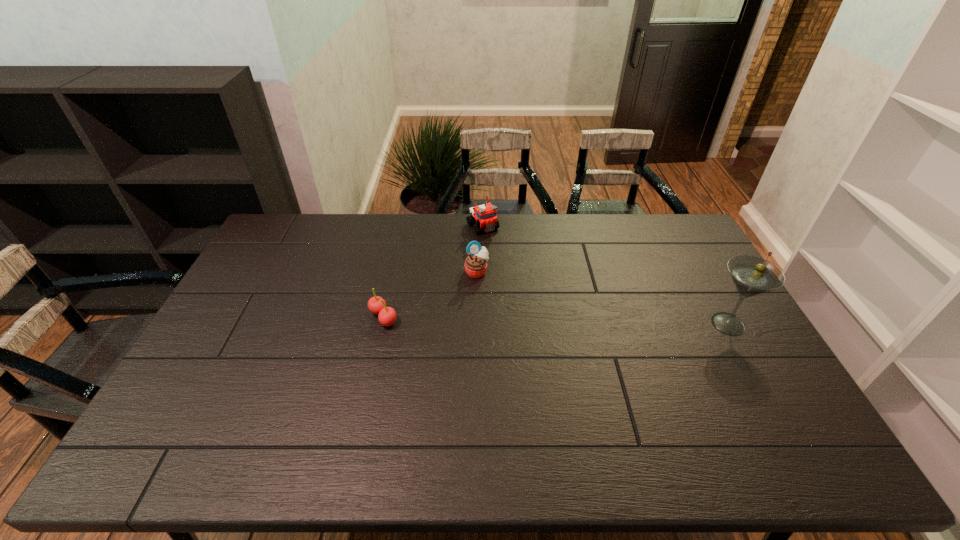
Identify the location of vacant space on the desktop that is between the cherry and the tallest object and is positioned on the front-facing side of the muffin. (541, 321).

What are the coordinates of `free space on the desktop that is between the leftmost object and the rightmost object and is positioned on the front-facing side of the farthest object` in the screenshot? It's located at (560, 321).